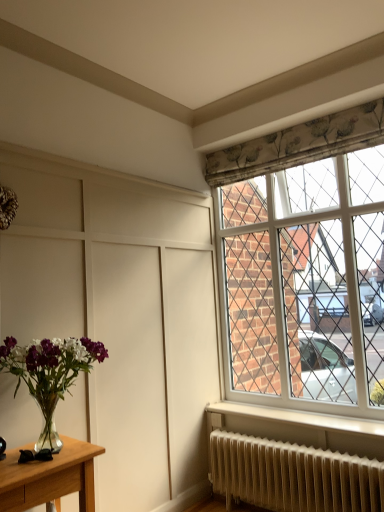
Question: Is clear glass vase at lower left inside the boundaries of white textured radiator at lower right, or outside?

Choices:
 (A) outside
 (B) inside

Answer: (A)

Question: Considering the positions of clear glass vase at lower left and white textured radiator at lower right in the image, is clear glass vase at lower left wider or thinner than white textured radiator at lower right?

Choices:
 (A) wide
 (B) thin

Answer: (A)

Question: Based on their relative distances, which object is nearer to the clear glass vase at lower left?

Choices:
 (A) white plastic window at upper right
 (B) white textured radiator at lower right

Answer: (B)

Question: Considering the real-world distances, which object is farthest from the clear glass vase at lower left?

Choices:
 (A) white plastic window at upper right
 (B) white textured radiator at lower right

Answer: (A)